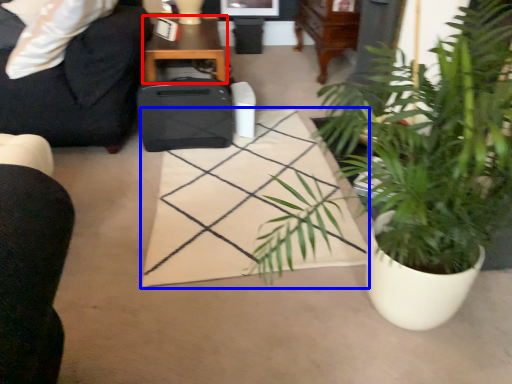
Question: Which object appears farthest to the camera in this image, table (highlighted by a red box) or plain (highlighted by a blue box)?

Choices:
 (A) table
 (B) plain

Answer: (A)